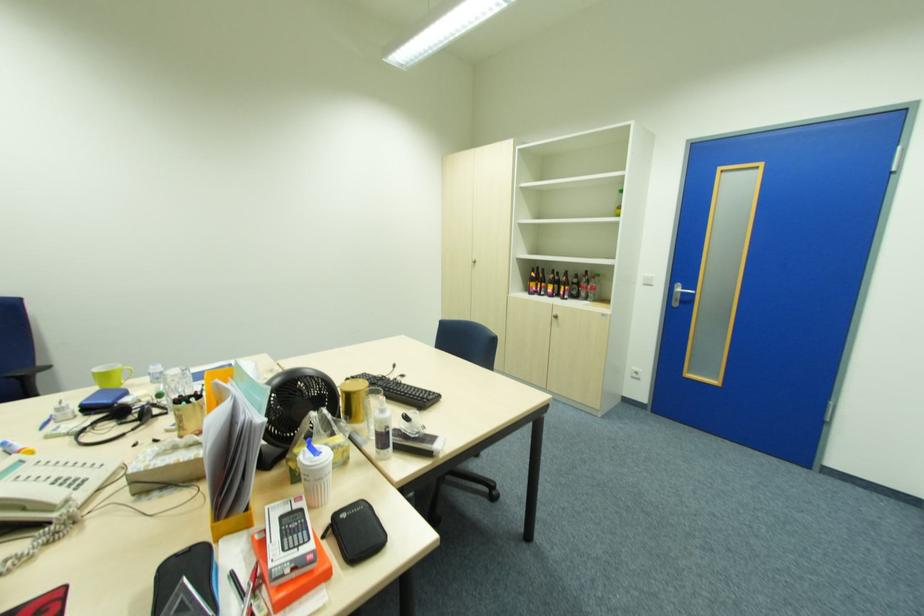
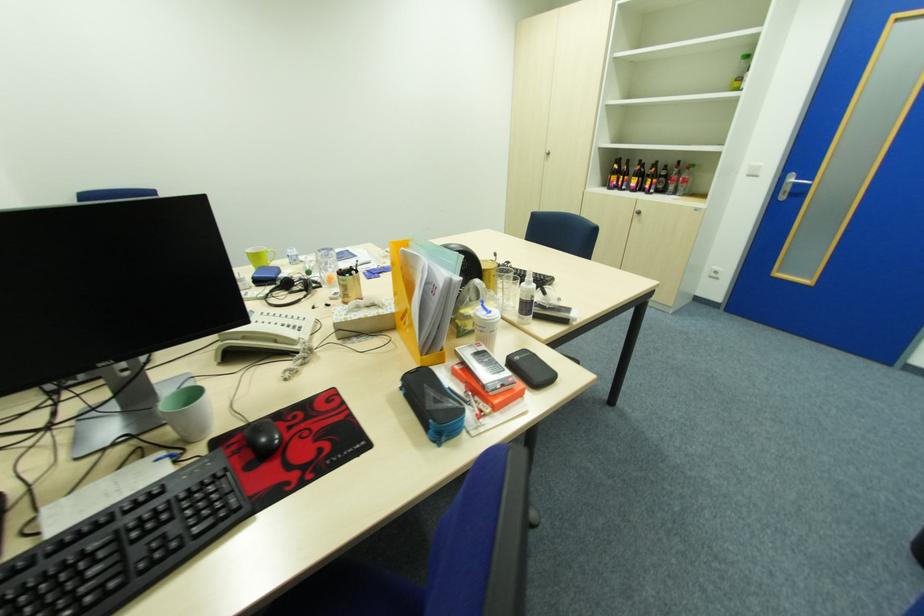
Question: In a continuous first-person perspective shot, in which direction is the camera moving?

Choices:
 (A) Left
 (B) Right
 (C) Forward
 (D) Backward

Answer: (A)